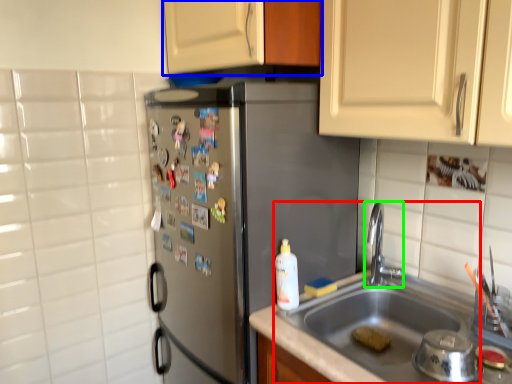
Question: Which is nearer to the sink (highlighted by a red box)? cabinetry (highlighted by a blue box) or tap (highlighted by a green box).

Choices:
 (A) cabinetry
 (B) tap

Answer: (B)